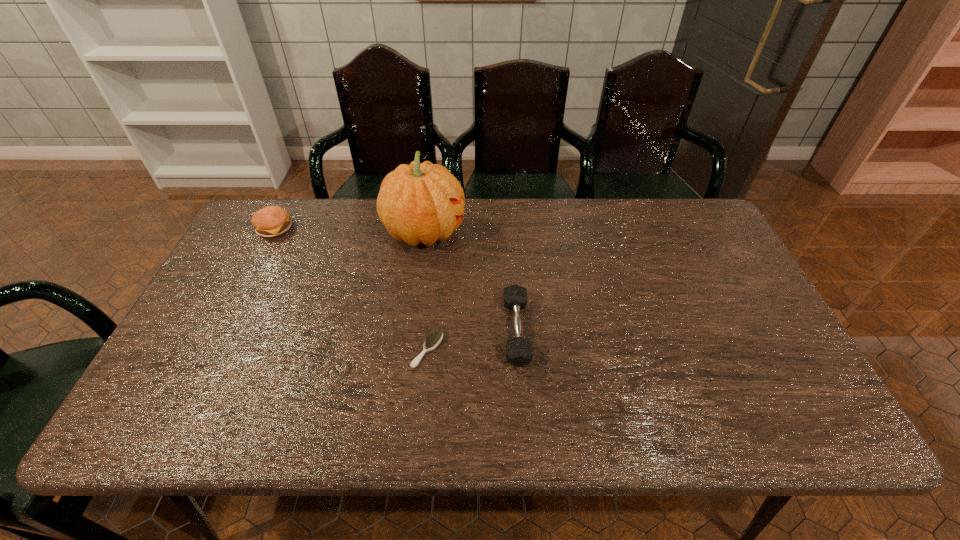
Point out which object is positioned as the nearest to the tallest object. Please provide its 2D coordinates. Your answer should be formatted as a tuple, i.e. [(x, y)], where the tuple contains the x and y coordinates of a point satisfying the conditions above.

[(519, 352)]

I want to click on vacant position in the image that satisfies the following two spatial constraints: 1. on the carved face of the tallest object; 2. on the right side of the dumbbell, so click(x=411, y=331).

The image size is (960, 540). What are the coordinates of `free spot that satisfies the following two spatial constraints: 1. on the carved face of the tallest object; 2. on the right side of the dumbbell` in the screenshot? It's located at (411, 331).

Locate an element on the screen. Image resolution: width=960 pixels, height=540 pixels. vacant space that satisfies the following two spatial constraints: 1. on the back side of the scrubbing brush; 2. on the carved face of the pumpkin is located at coordinates (439, 232).

Where is `free spot that satisfies the following two spatial constraints: 1. on the carved face of the tallest object; 2. on the left side of the scrubbing brush`? free spot that satisfies the following two spatial constraints: 1. on the carved face of the tallest object; 2. on the left side of the scrubbing brush is located at coordinates (409, 350).

Where is `vacant area in the image that satisfies the following two spatial constraints: 1. on the carved face of the pumpkin; 2. on the right side of the dumbbell`? The width and height of the screenshot is (960, 540). vacant area in the image that satisfies the following two spatial constraints: 1. on the carved face of the pumpkin; 2. on the right side of the dumbbell is located at coordinates (411, 331).

Where is `free point that satisfies the following two spatial constraints: 1. on the carved face of the scrubbing brush; 2. on the left side of the pumpkin`? free point that satisfies the following two spatial constraints: 1. on the carved face of the scrubbing brush; 2. on the left side of the pumpkin is located at coordinates (409, 350).